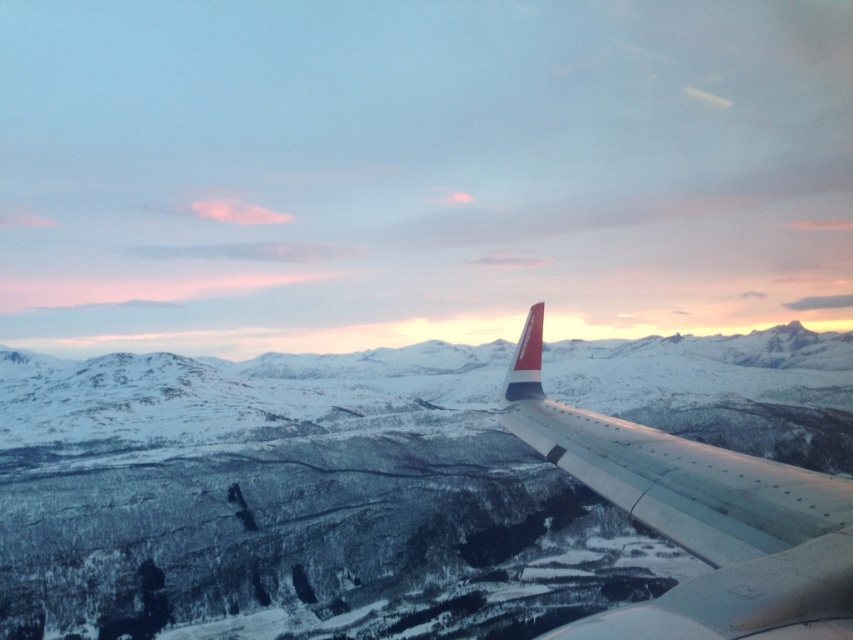
You are a pilot flying an airplane and want to ensure safe passage through the mountains. Given the image, which object has a greater width, the snowy mountain at center or the white metallic wing at right?

The snowy mountain at center has a greater width than the white metallic wing at right according to the description.

You are a pilot flying an airplane and want to know how far you are from the point marked as point (227, 419) in the scene. Can you determine the distance?

The distance between you and point (227, 419) is 649.97 feet.

You are a pilot flying an airplane and you notice the snowy mountain at center and the white metallic wing at right in your view. Which object appears larger in your current perspective?

The snowy mountain at center appears larger than the white metallic wing at right in your current perspective.